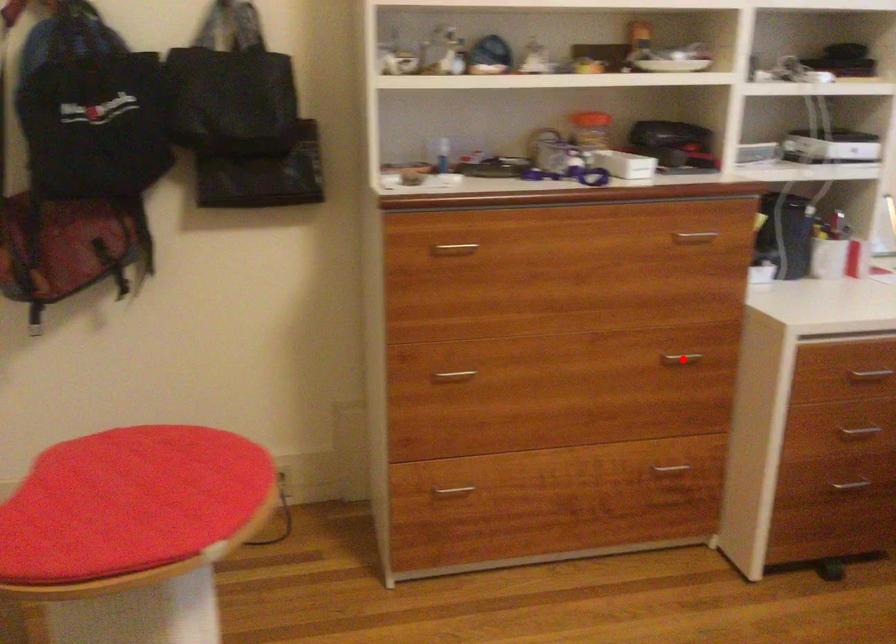
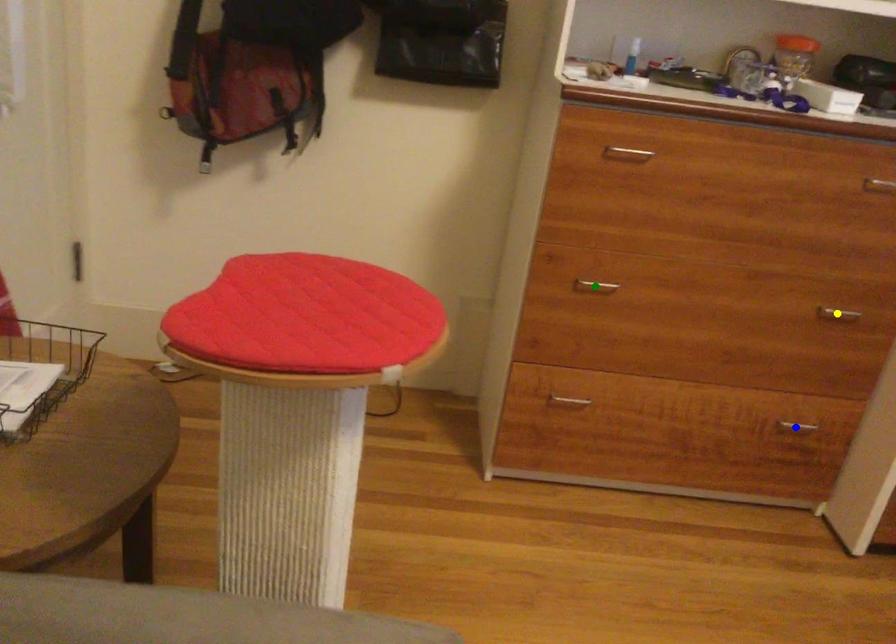
Question: I am providing you with two images of the same scene from different viewpoints. A red point is marked on the first image. You are given multiple points on the second image. Which spot in image 2 lines up with the point in image 1?

Choices:
 (A) yellow point
 (B) green point
 (C) blue point

Answer: (A)